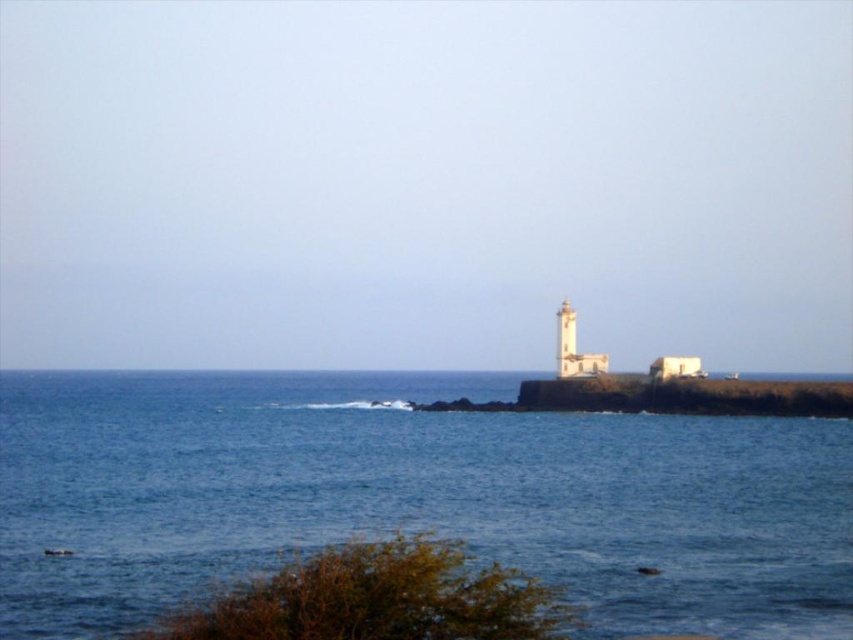
You are standing at the base of the lighthouse and looking out towards the ocean. You notice two points marked on the image at coordinates point [569,336] and point [561,308]. Which of these points appears closer to you in the scene?

Point [569,336] is closer to the camera than point [561,308], so the point at coordinates point [569,336] appears closer to you in the scene.

You are a bird soaring above the coastal scene. You see the blue water at center and the white stucco lighthouse at center. Which one is located below the other?

The blue water at center is positioned under the white stucco lighthouse at center, so the blue water is below the lighthouse.